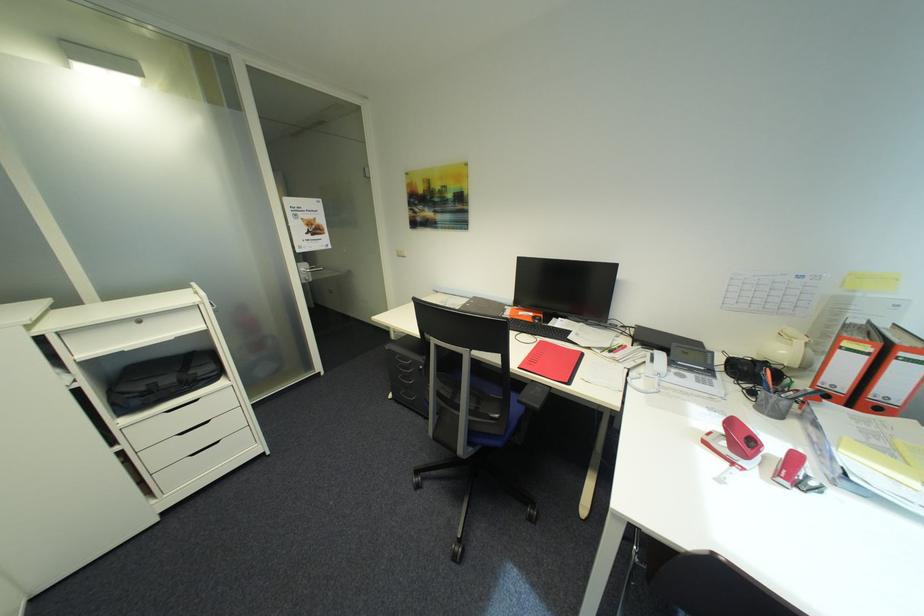
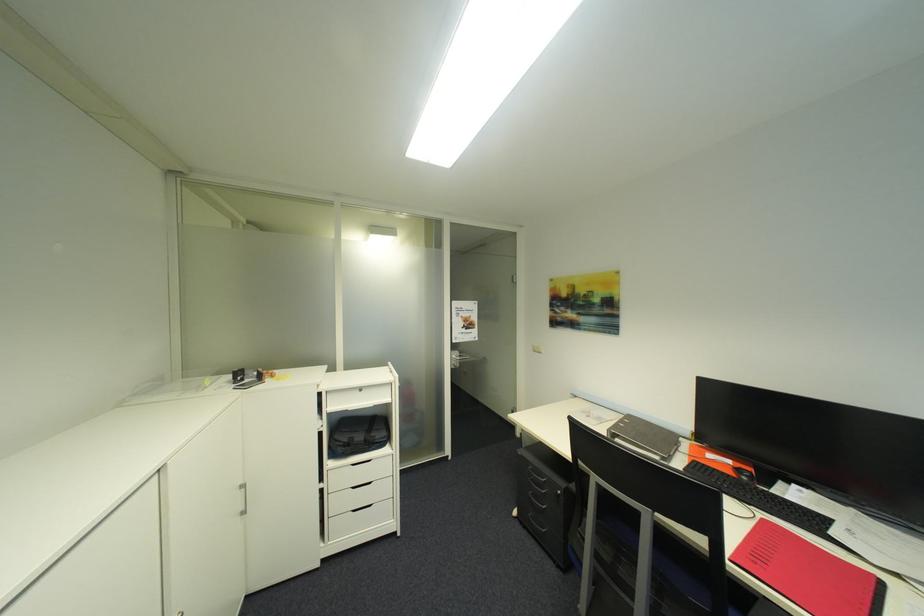
The point at (415, 383) is marked in the first image. Where is the corresponding point in the second image?

(544, 505)